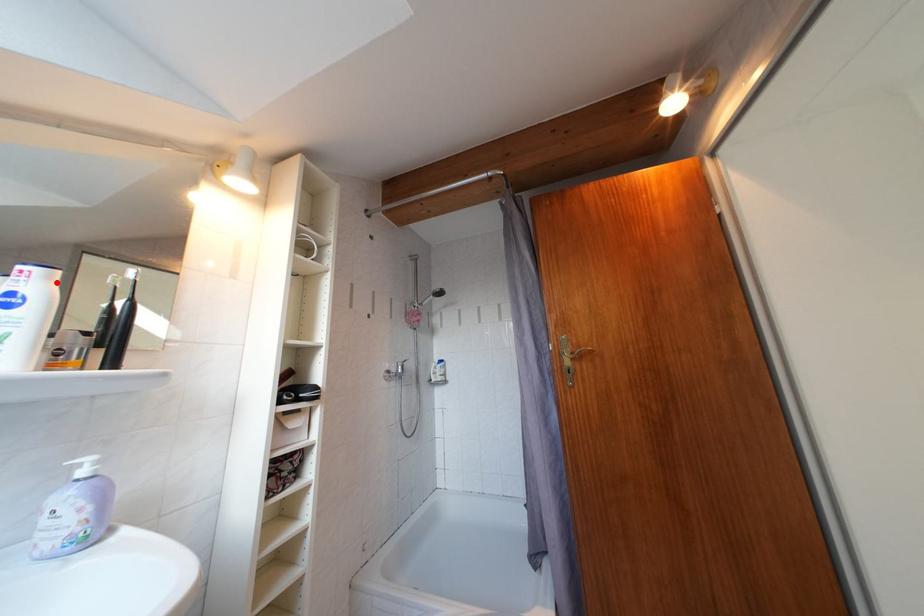
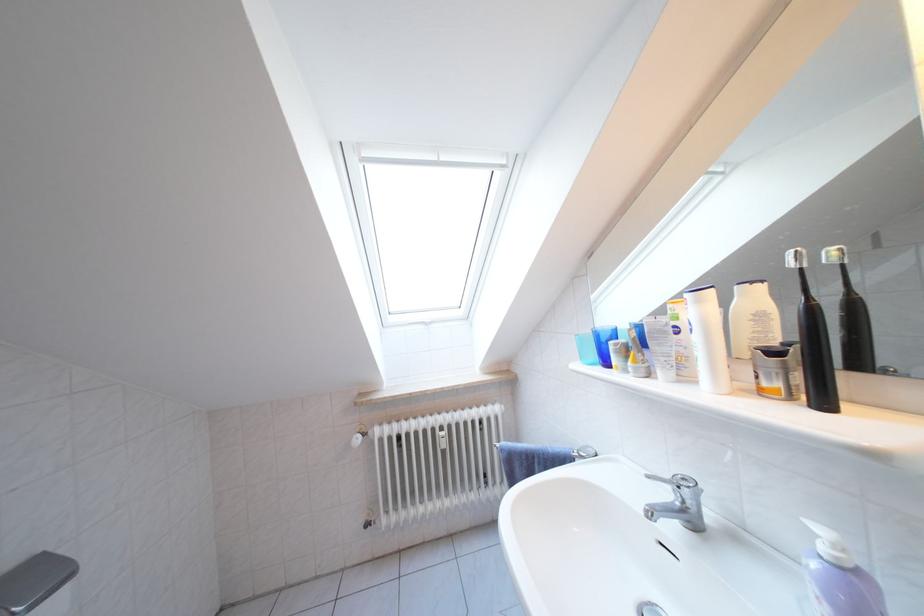
In the second image, find the point that corresponds to the highlighted location in the first image.

(708, 306)